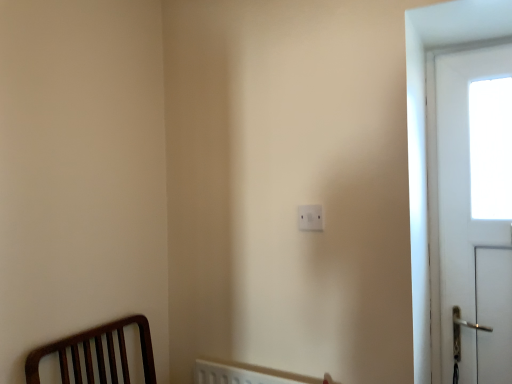
Describe the element at coordinates (456, 187) in the screenshot. The width and height of the screenshot is (512, 384). I see `white glossy door at right` at that location.

Locate an element on the screen. white glossy door at right is located at coordinates (456, 187).

I want to click on white plastic light switch at center, so click(310, 217).

In order to face white plastic light switch at center, should I rotate leftwards or rightwards?

A 7.346 degree turn to the right will do.

The height and width of the screenshot is (384, 512). What do you see at coordinates (310, 217) in the screenshot?
I see `white plastic light switch at center` at bounding box center [310, 217].

At what (x,y) coordinates should I click in order to perform the action: click on white glossy door at right. Please return your answer as a coordinate pair (x, y). Looking at the image, I should click on (456, 187).

Considering the relative positions of white glossy door at right and white plastic light switch at center in the image provided, is white glossy door at right to the right of white plastic light switch at center from the viewer's perspective?

Correct, you'll find white glossy door at right to the right of white plastic light switch at center.

Does white glossy door at right lie in front of white plastic light switch at center?

That is False.

Does point (496, 47) appear closer or farther from the camera than point (298, 225)?

Clearly, point (496, 47) is more distant from the camera than point (298, 225).

From the image's perspective, between white glossy door at right and white plastic light switch at center, which one is located above?

white glossy door at right.

From a real-world perspective, is white glossy door at right under white plastic light switch at center?

Yes, from a real-world perspective, white glossy door at right is under white plastic light switch at center.

Which of these two, white glossy door at right or white plastic light switch at center, is thinner?

With smaller width is white plastic light switch at center.

Can you confirm if white glossy door at right is taller than white plastic light switch at center?

Yes.

Considering the sizes of objects white glossy door at right and white plastic light switch at center in the image provided, who is smaller, white glossy door at right or white plastic light switch at center?

white plastic light switch at center is smaller.

Is white glossy door at right not within white plastic light switch at center?

white glossy door at right lies outside white plastic light switch at center's area.

Would you say white glossy door at right is a long distance from white plastic light switch at center?

No.

Is white glossy door at right oriented towards white plastic light switch at center?

No, white glossy door at right is not facing towards white plastic light switch at center.

Can you tell me how much white glossy door at right and white plastic light switch at center differ in facing direction?

0.107 degrees.

Locate an element on the screen. This screenshot has height=384, width=512. light switch that appears below the white glossy door at right (from the image's perspective) is located at coordinates (310, 217).

Can you confirm if white plastic light switch at center is positioned to the left of white glossy door at right?

Correct, you'll find white plastic light switch at center to the left of white glossy door at right.

Is white plastic light switch at center closer to camera compared to white glossy door at right?

Yes, white plastic light switch at center is in front of white glossy door at right.

Is point (316, 216) farther from viewer compared to point (444, 141)?

No, (316, 216) is in front of (444, 141).

Based on the photo, from the image's perspective, is white plastic light switch at center on white glossy door at right?

No.

From a real-world perspective, who is located lower, white plastic light switch at center or white glossy door at right?

From a 3D spatial view, white glossy door at right is below.

Considering the sizes of white plastic light switch at center and white glossy door at right in the image, is white plastic light switch at center wider or thinner than white glossy door at right?

Clearly, white plastic light switch at center has less width compared to white glossy door at right.

In terms of height, does white plastic light switch at center look taller or shorter compared to white glossy door at right?

In the image, white plastic light switch at center appears to be shorter than white glossy door at right.

Based on the photo, does white plastic light switch at center have a larger size compared to white glossy door at right?

Actually, white plastic light switch at center might be smaller than white glossy door at right.

Is white glossy door at right inside white plastic light switch at center?

That's incorrect, white glossy door at right is not inside white plastic light switch at center.

Is white plastic light switch at center in contact with white glossy door at right?

There is a gap between white plastic light switch at center and white glossy door at right.

Is white plastic light switch at center looking in the opposite direction of white glossy door at right?

That's not correct — white plastic light switch at center is not looking away from white glossy door at right.

How different are the orientations of white plastic light switch at center and white glossy door at right in degrees?

The facing directions of white plastic light switch at center and white glossy door at right are 0.107 degrees apart.

Identify the location of light switch on the left of white glossy door at right. (310, 217).

Find the location of a particular element. The height and width of the screenshot is (384, 512). screen door below the white plastic light switch at center (from a real-world perspective) is located at coordinates (456, 187).

At what (x,y) coordinates should I click in order to perform the action: click on light switch located in front of the white glossy door at right. Please return your answer as a coordinate pair (x, y). Image resolution: width=512 pixels, height=384 pixels. Looking at the image, I should click on (310, 217).